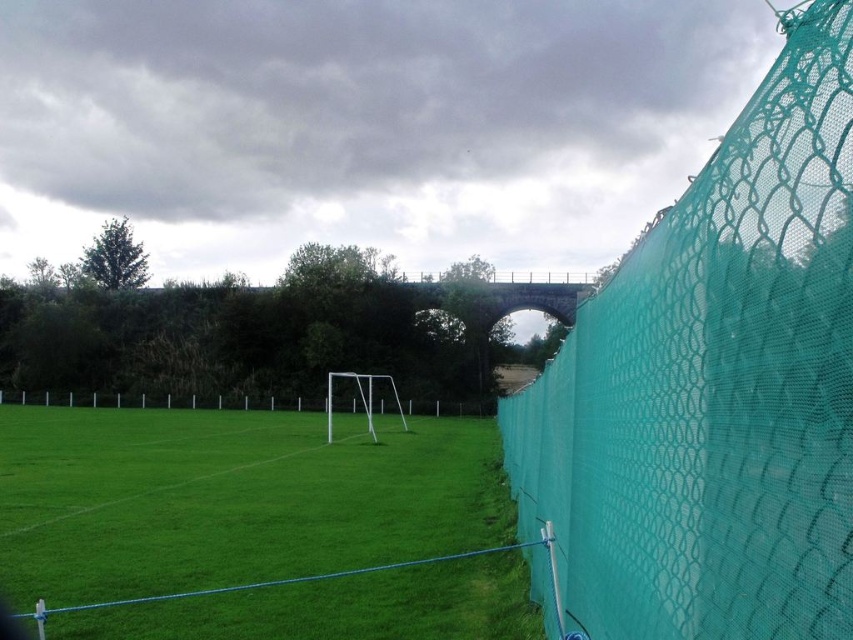
Question: Which point appears farthest from the camera in this image?

Choices:
 (A) (152, 396)
 (B) (131, 417)
 (C) (827, 120)

Answer: (A)

Question: Can you confirm if teal mesh fence at right is positioned below green mesh fence at center?

Choices:
 (A) no
 (B) yes

Answer: (A)

Question: Is teal mesh fence at right smaller than green grass at lower left?

Choices:
 (A) yes
 (B) no

Answer: (A)

Question: Does green grass at lower left have a greater width compared to green mesh fence at center?

Choices:
 (A) no
 (B) yes

Answer: (A)

Question: Which object appears closest to the camera in this image?

Choices:
 (A) green mesh fence at center
 (B) teal mesh fence at right

Answer: (B)

Question: Which object appears closest to the camera in this image?

Choices:
 (A) green mesh fence at center
 (B) teal mesh fence at right

Answer: (B)